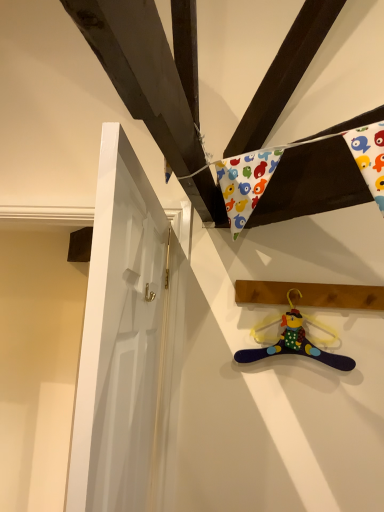
Question: From the image's perspective, relative to multicolored fabric hanger at lower right, is multicolored fabric hanger at lower right above or below?

Choices:
 (A) below
 (B) above

Answer: (B)

Question: Is multicolored fabric hanger at lower right inside or outside of multicolored fabric hanger at lower right?

Choices:
 (A) inside
 (B) outside

Answer: (B)

Question: Which is farther from the white glossy door at left?

Choices:
 (A) multicolored fabric hanger at lower right
 (B) wooden plank at upper right
 (C) multicolored fabric hanger at lower right

Answer: (A)

Question: Which is nearer to the multicolored fabric hanger at lower right?

Choices:
 (A) white glossy door at left
 (B) wooden plank at upper right
 (C) multicolored fabric hanger at lower right

Answer: (C)